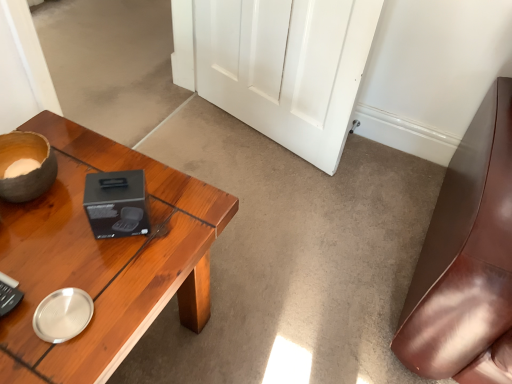
Locate an element on the screen. vacant location below white glossy door at center (from a real-world perspective) is located at coordinates (260, 147).